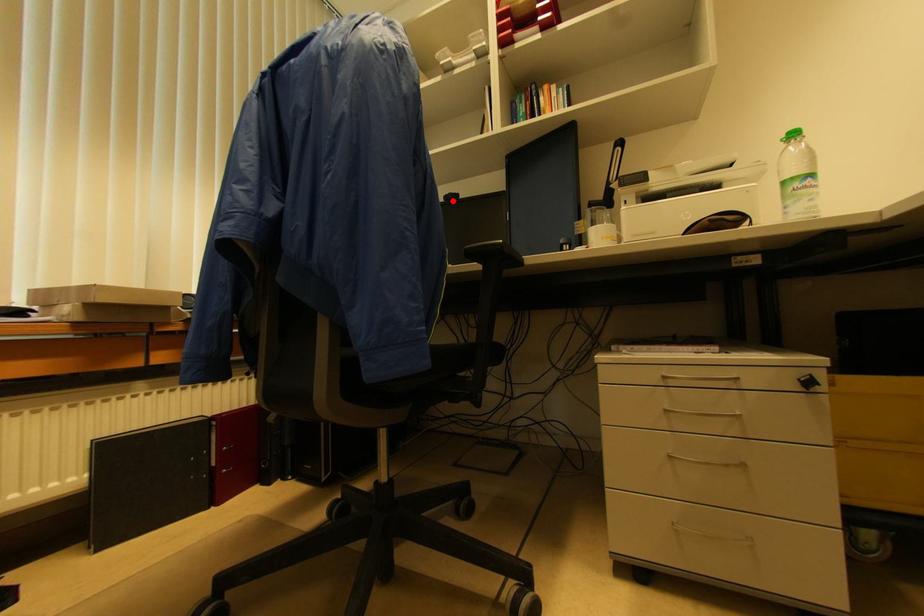
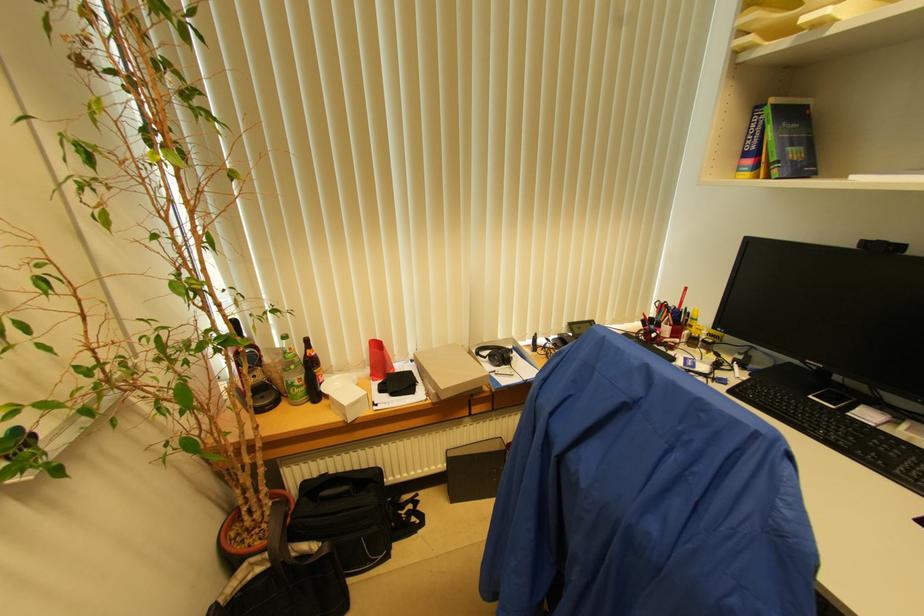
The point at the highlighted location is marked in the first image. Where is the corresponding point in the second image?

(882, 251)